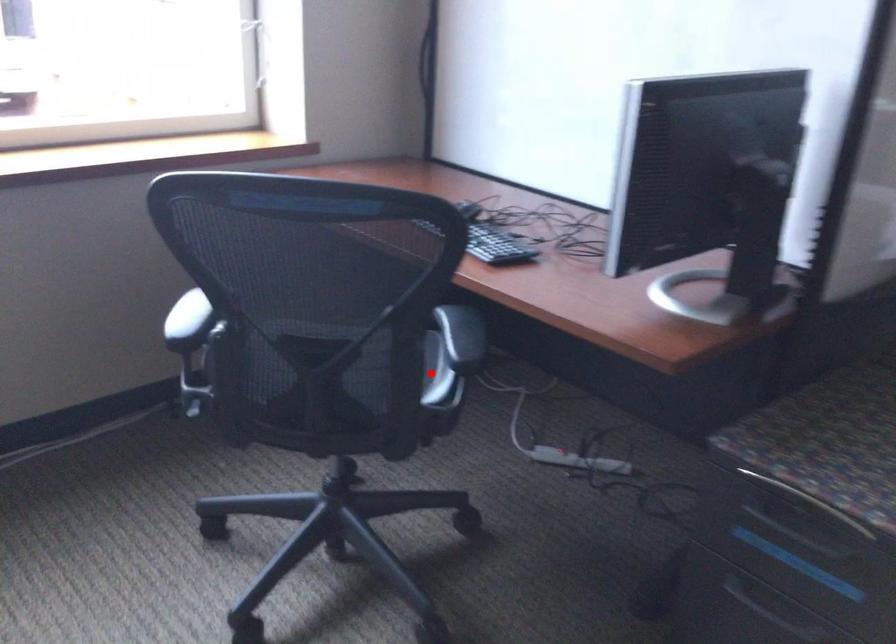
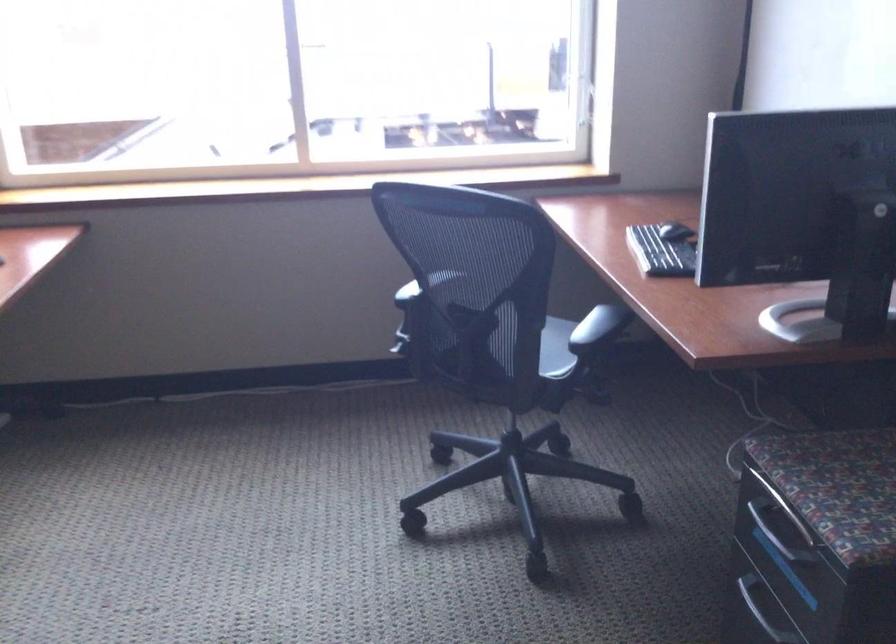
Where in the second image is the point corresponding to the highlighted location from the first image?

(541, 345)